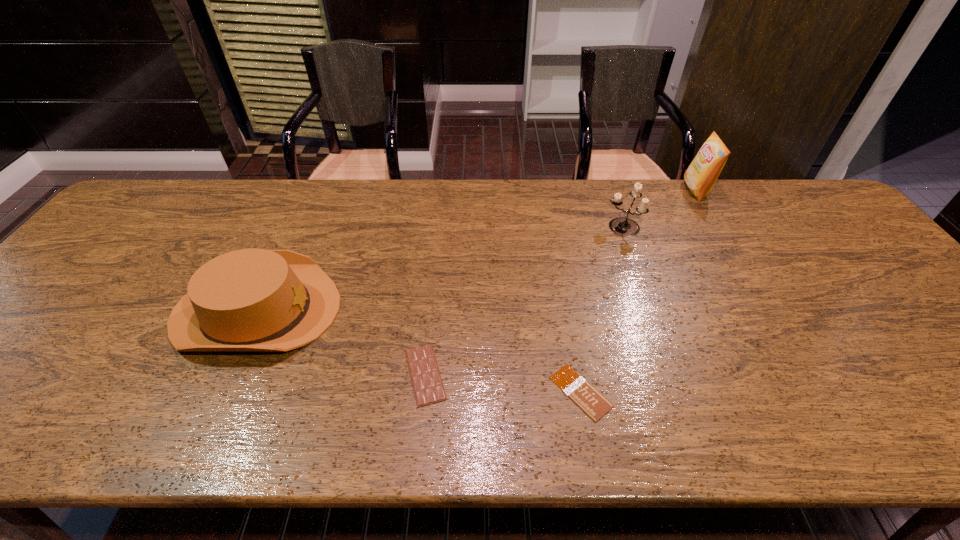
Locate an element on the screen. the rightmost object is located at coordinates (701, 175).

Where is `the tallest object`? the tallest object is located at coordinates (701, 175).

The height and width of the screenshot is (540, 960). In order to click on candle holder in this screenshot , I will do `click(622, 226)`.

The image size is (960, 540). In order to click on the second object from right to left in this screenshot , I will do `click(622, 226)`.

Locate an element on the screen. the third shortest object is located at coordinates (253, 299).

Locate an element on the screen. The image size is (960, 540). the leftmost object is located at coordinates (253, 299).

The width and height of the screenshot is (960, 540). Identify the location of the fourth object from right to left. (427, 384).

Find the location of a particular element. Image resolution: width=960 pixels, height=540 pixels. the taller chocolate bar is located at coordinates (427, 384).

Find the location of a particular element. The width and height of the screenshot is (960, 540). the third object from left to right is located at coordinates (582, 393).

Locate an element on the screen. the right chocolate bar is located at coordinates (582, 393).